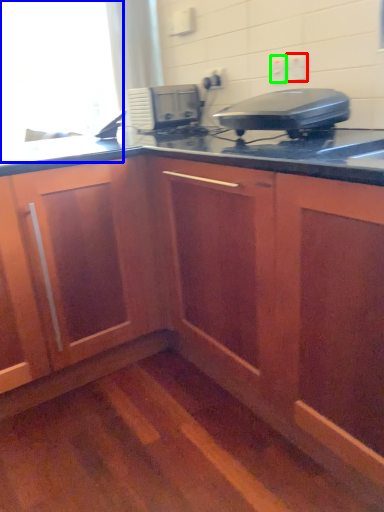
Question: Which object is positioned farthest from electric outlet (highlighted by a red box)? Select from window screen (highlighted by a blue box) and electric outlet (highlighted by a green box).

Choices:
 (A) window screen
 (B) electric outlet

Answer: (A)